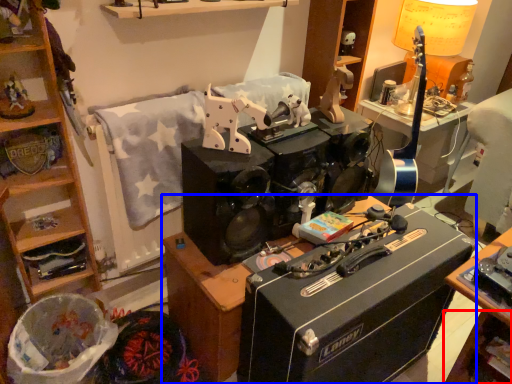
Question: Among these objects, which one is nearest to the camera, shelf (highlighted by a red box) or desk (highlighted by a blue box)?

Choices:
 (A) shelf
 (B) desk

Answer: (B)